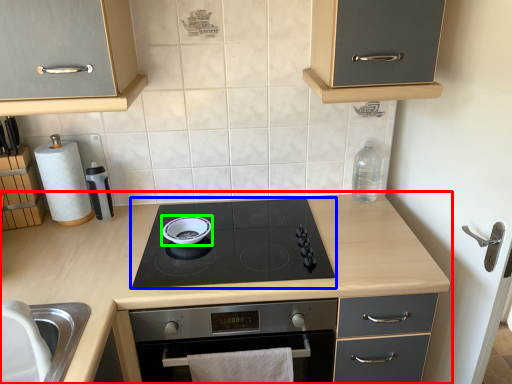
Question: Which object is positioned closest to countertop (highlighted by a red box)? Select from gas stove (highlighted by a blue box) and soup bowl (highlighted by a green box).

Choices:
 (A) gas stove
 (B) soup bowl

Answer: (A)